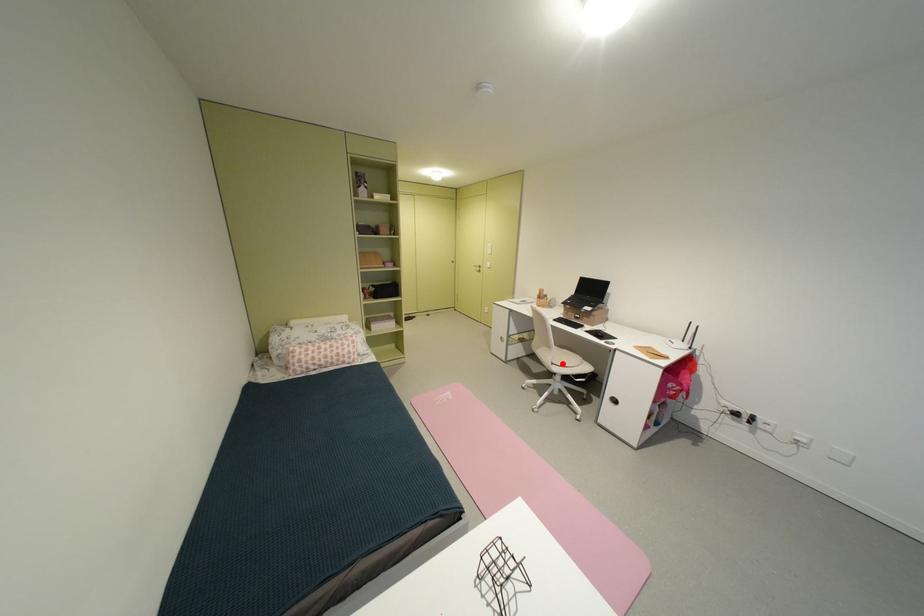
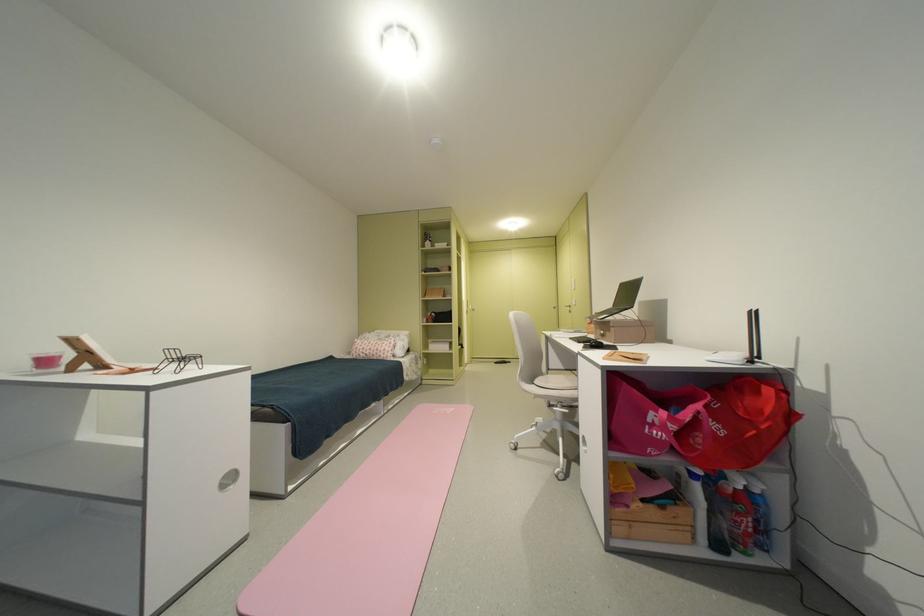
Question: I am providing you with two images of the same scene from different viewpoints. Image1 has a red point marked. In image2, the corresponding 3D location appears at what relative position? Reply with the corresponding letter.

Choices:
 (A) Closer
 (B) Farther

Answer: (B)